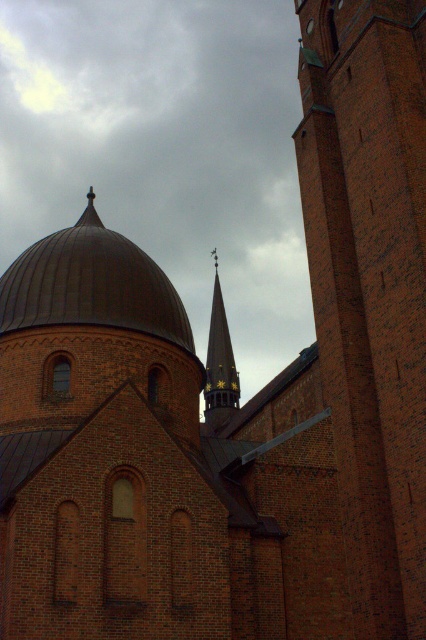
How far apart are dark brown metallic dome at center and goldmetallicspire at upper center?

A distance of 19.19 meters exists between dark brown metallic dome at center and goldmetallicspire at upper center.

Which is above, dark brown metallic dome at center or goldmetallicspire at upper center?

dark brown metallic dome at center

Is point (48, 324) positioned behind point (227, 392)?

That is False.

The image size is (426, 640). What are the coordinates of `dark brown metallic dome at center` in the screenshot? It's located at (92, 284).

Does brick tower at right have a greater width compared to dark brown metallic dome at center?

No, brick tower at right is not wider than dark brown metallic dome at center.

The height and width of the screenshot is (640, 426). What do you see at coordinates (370, 285) in the screenshot?
I see `brick tower at right` at bounding box center [370, 285].

Where is `brick tower at right`? brick tower at right is located at coordinates (370, 285).

Is brick tower at right smaller than goldmetallicspire at upper center?

Actually, brick tower at right might be larger than goldmetallicspire at upper center.

Is brick tower at right taller than goldmetallicspire at upper center?

Yes, brick tower at right is taller than goldmetallicspire at upper center.

I want to click on brick tower at right, so click(370, 285).